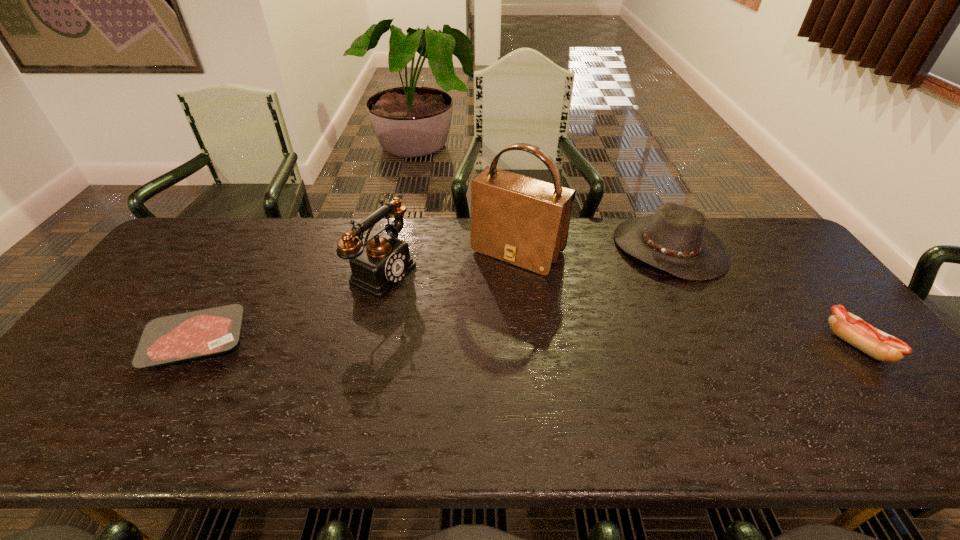
In order to click on vacant space located on the right of the steak in this screenshot , I will do `click(356, 342)`.

Find the location of `free space located 0.320m on the left of the second shortest object`. free space located 0.320m on the left of the second shortest object is located at coordinates (708, 345).

Identify the location of vacant space situated 0.300m on the front flap of the third object from left to right. Image resolution: width=960 pixels, height=540 pixels. click(x=440, y=342).

Identify the location of vacant space located 0.160m on the front flap of the third object from left to right. The height and width of the screenshot is (540, 960). (468, 308).

Image resolution: width=960 pixels, height=540 pixels. In order to click on free location located on the front flap of the third object from left to right in this screenshot , I will do `click(454, 324)`.

Locate an element on the screen. The width and height of the screenshot is (960, 540). vacant space located on the front-facing side of the third shortest object is located at coordinates (640, 288).

Find the location of a particular element. blank area located 0.210m on the front-facing side of the third shortest object is located at coordinates (620, 316).

The height and width of the screenshot is (540, 960). What are the coordinates of `vacant position located on the front-facing side of the third shortest object` in the screenshot? It's located at (636, 293).

You are a GUI agent. You are given a task and a screenshot of the screen. Output one action in this format:
    pyautogui.click(x=<x>, y=<y>)
    Task: Click on the vacant space located on the front of the second object from left to right at the rotary dial
    
    Given the screenshot: What is the action you would take?
    pyautogui.click(x=482, y=319)

Find the location of `free space located on the front of the second object from left to right at the rotary dial`. free space located on the front of the second object from left to right at the rotary dial is located at coordinates (464, 311).